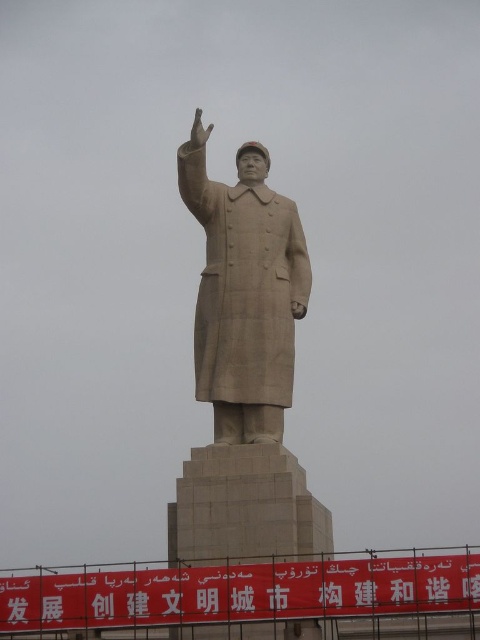
Looking at this image, you are a photographer trying to capture the matte stone statue at center and the matte stone hand at upper center in a single shot. Can you see both objects clearly in your camera frame?

The matte stone statue at center is in front of the matte stone hand at upper center, so the statue will block part of the hand, making it difficult to see both clearly in the same frame.

You are a photographer standing in front of the statue. You want to capture a photo where the matte stone statue at center and the matte stone hand at upper center are both visible. Based on their positions, which object should appear closer to the left side of the photo?

The matte stone hand at upper center should appear closer to the left side of the photo because the matte stone statue at center is positioned to its right.

You are standing at point (244, 294) in the image. What object is located exactly at your current position?

The matte stone statue at center is located exactly at point (244, 294).